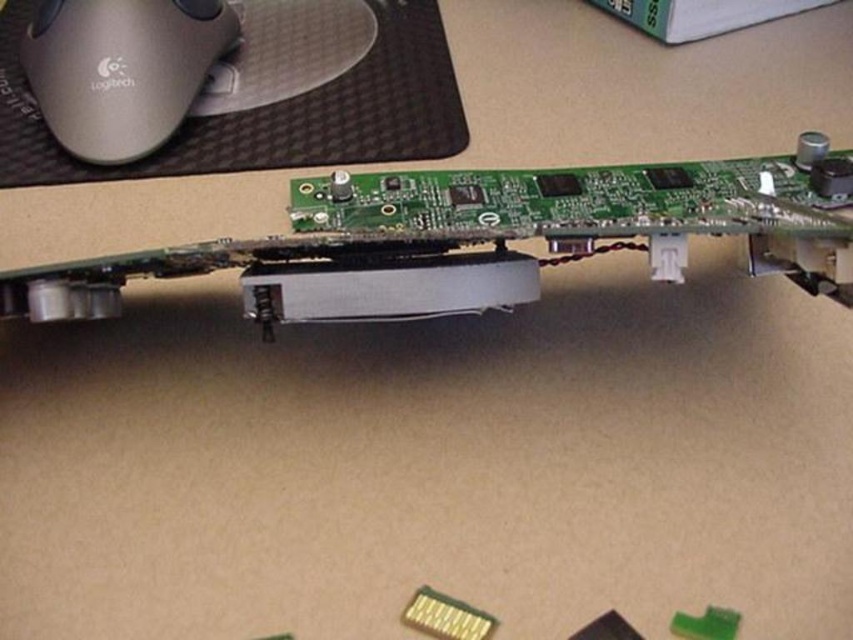
Which is more to the right, black rubber mousepad at upper center or matte white mouse at upper left?

From the viewer's perspective, black rubber mousepad at upper center appears more on the right side.

Is black rubber mousepad at upper center above matte white mouse at upper left?

No.

Is point (364, 83) positioned before point (86, 118)?

No, it is not.

Locate an element on the screen. Image resolution: width=853 pixels, height=640 pixels. black rubber mousepad at upper center is located at coordinates (271, 113).